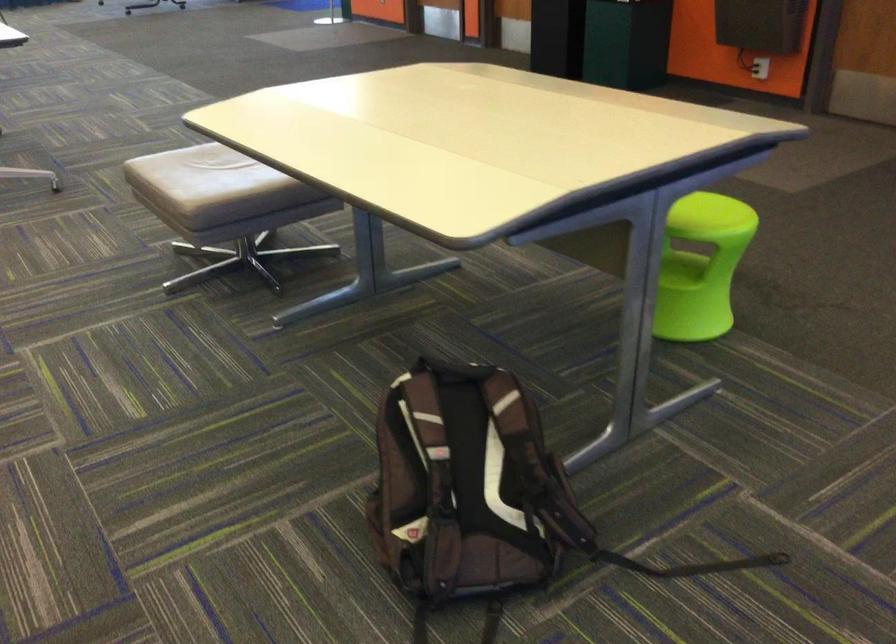
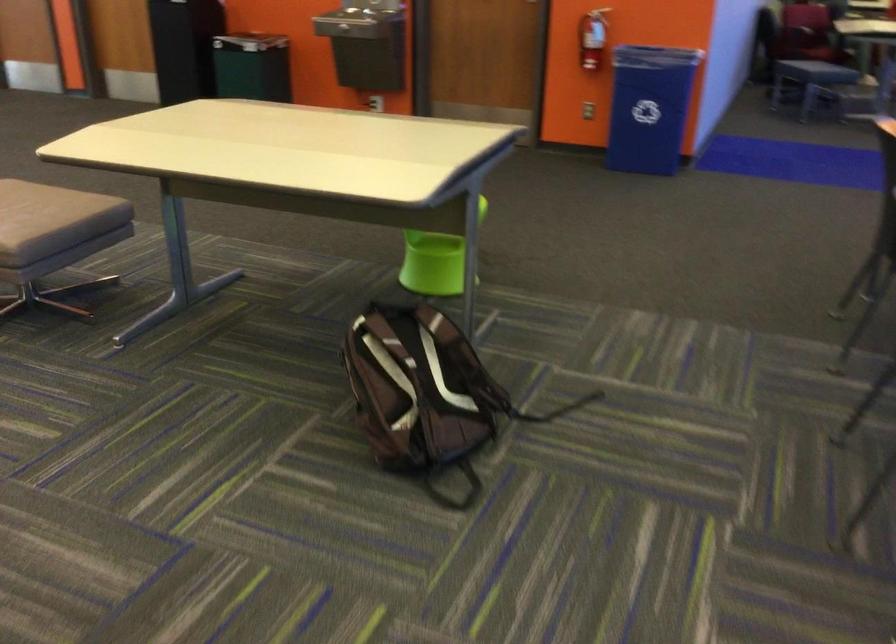
Locate, in the second image, the point that corresponds to point (443, 496) in the first image.

(419, 392)